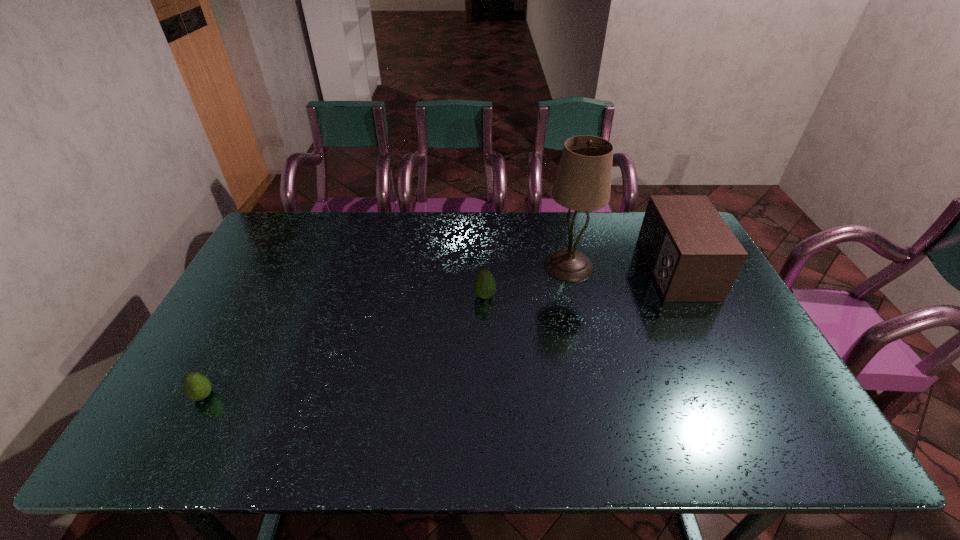
Locate an element on the screen. The image size is (960, 540). vacant space at the near edge of the desktop is located at coordinates 521,437.

What are the coordinates of `vacant region at the left edge of the desktop` in the screenshot? It's located at (239, 307).

I want to click on vacant area at the right edge of the desktop, so click(x=723, y=349).

In order to click on blank area at the far left corner in this screenshot , I will do coord(279,221).

The image size is (960, 540). In order to click on vacant point at the near right corner in this screenshot , I will do `click(756, 448)`.

Find the location of a particular element. This screenshot has height=540, width=960. empty space between the third shortest object and the left avocado is located at coordinates (439, 332).

At what (x,y) coordinates should I click in order to perform the action: click on unoccupied area between the rightmost object and the right avocado. Please return your answer as a coordinate pair (x, y). Looking at the image, I should click on (580, 282).

At what (x,y) coordinates should I click in order to perform the action: click on free space between the rightmost object and the third tallest object. Please return your answer as a coordinate pair (x, y). Image resolution: width=960 pixels, height=540 pixels. Looking at the image, I should click on (580, 282).

I want to click on free spot between the shortest object and the tallest object, so click(386, 331).

The width and height of the screenshot is (960, 540). I want to click on free spot between the third object from left to right and the second tallest object, so click(x=621, y=267).